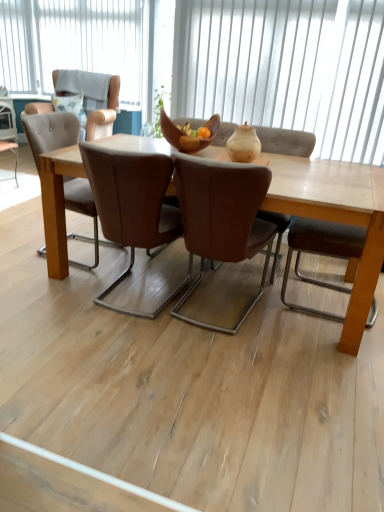
Find the location of a particular element. free space in front of brown leather chair at center, the 2th chair positioned from the right is located at coordinates (127, 344).